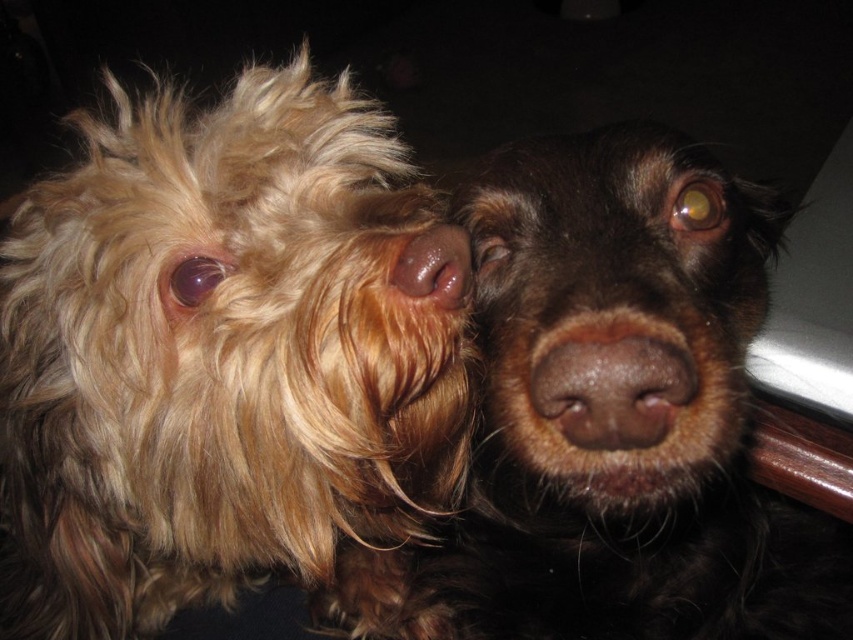
Who is more distant from viewer, (305, 337) or (660, 310)?

Point (305, 337)

Which is behind, point (368, 435) or point (587, 417)?

Point (368, 435)

This screenshot has height=640, width=853. I want to click on shaggy golden fur at left, so click(219, 362).

Is brown furry dog at center positioned before brown matte nose at center?

Yes, it is.

Is brown furry dog at center shorter than brown matte nose at center?

Incorrect, brown furry dog at center's height does not fall short of brown matte nose at center's.

Where is `brown furry dog at center`? brown furry dog at center is located at coordinates (625, 406).

I want to click on brown furry dog at center, so click(625, 406).

Which is below, brown furry dog at center or glossy brown nose at center?

brown furry dog at center is below.

Where is `brown furry dog at center`? Image resolution: width=853 pixels, height=640 pixels. brown furry dog at center is located at coordinates (625, 406).

What do you see at coordinates (625, 406) in the screenshot?
I see `brown furry dog at center` at bounding box center [625, 406].

Locate an element on the screen. brown furry dog at center is located at coordinates (625, 406).